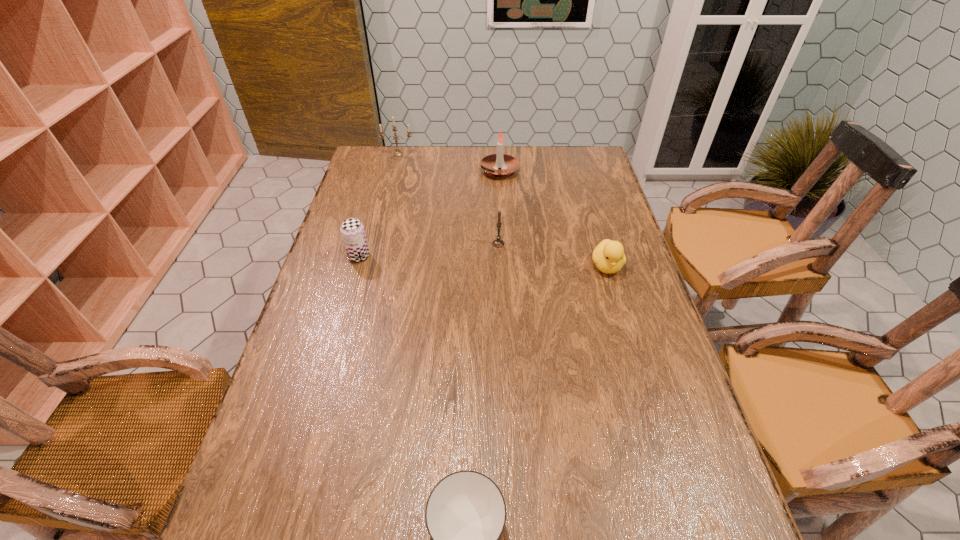
At what (x,y) coordinates should I click in order to perform the action: click on vacant space situated 0.210m on the right of the beer can. Please return your answer as a coordinate pair (x, y). The image size is (960, 540). Looking at the image, I should click on (441, 256).

Identify the location of free location located 0.130m on the front-facing side of the duck. (621, 316).

The image size is (960, 540). I want to click on candle that is at the left edge, so click(397, 153).

The height and width of the screenshot is (540, 960). Identify the location of beer can present at the left edge. (352, 230).

Find the location of a particular element. Image resolution: width=960 pixels, height=540 pixels. object that is at the right edge is located at coordinates (608, 256).

Find the location of a particular element. object that is positioned at the far left corner is located at coordinates (397, 153).

At what (x,y) coordinates should I click in order to perform the action: click on vacant area at the far edge. Please return your answer as a coordinate pair (x, y). Looking at the image, I should click on (546, 166).

In the image, there is a desktop. What are the coordinates of `blank space at the left edge` in the screenshot? It's located at (375, 236).

In the image, there is a desktop. What are the coordinates of `vacant space at the right edge` in the screenshot? It's located at point(651,349).

In the image, there is a desktop. Where is `vacant space at the far right corner`? vacant space at the far right corner is located at coordinates click(562, 150).